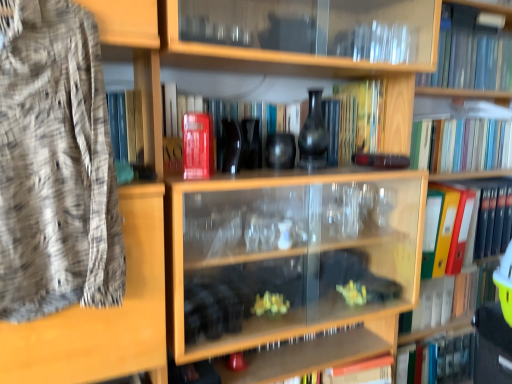
Question: Can you confirm if matte black vase at center is wider than transparent glass book at upper right, the 1th book positioned from the top?

Choices:
 (A) no
 (B) yes

Answer: (A)

Question: Does matte black vase at center lie behind transparent glass book at upper right, the 1th book positioned from the top?

Choices:
 (A) no
 (B) yes

Answer: (A)

Question: Can you confirm if matte black vase at center is thinner than transparent glass book at upper right, marked as the seventh book in a bottom-to-top arrangement?

Choices:
 (A) yes
 (B) no

Answer: (A)

Question: Can you confirm if matte black vase at center is smaller than transparent glass book at upper right, the 1th book positioned from the top?

Choices:
 (A) yes
 (B) no

Answer: (A)

Question: Considering the relative positions of matte black vase at center and transparent glass book at upper right, marked as the seventh book in a bottom-to-top arrangement, in the image provided, is matte black vase at center to the right of transparent glass book at upper right, marked as the seventh book in a bottom-to-top arrangement, from the viewer's perspective?

Choices:
 (A) no
 (B) yes

Answer: (A)

Question: Is point (481, 292) closer or farther from the camera than point (309, 102)?

Choices:
 (A) closer
 (B) farther

Answer: (B)

Question: From the image's perspective, is yellow plastic folder at right, which is the 1th book in bottom-to-top order, located above or below matte black vase at center?

Choices:
 (A) above
 (B) below

Answer: (B)

Question: Is yellow plastic folder at right, which is the seventh book from top to bottom, wider or thinner than matte black vase at center?

Choices:
 (A) wide
 (B) thin

Answer: (A)

Question: Based on their positions, is yellow plastic folder at right, which is the 1th book in bottom-to-top order, located to the left or right of matte black vase at center?

Choices:
 (A) left
 (B) right

Answer: (B)

Question: Considering the positions of multicolored hardcover books at upper right, placed as the 5th book when sorted from bottom to top, and transparent glass book at upper right, marked as the seventh book in a bottom-to-top arrangement, in the image, is multicolored hardcover books at upper right, placed as the 5th book when sorted from bottom to top, taller or shorter than transparent glass book at upper right, marked as the seventh book in a bottom-to-top arrangement,?

Choices:
 (A) short
 (B) tall

Answer: (B)

Question: Does point (461, 145) appear closer or farther from the camera than point (457, 21)?

Choices:
 (A) closer
 (B) farther

Answer: (B)

Question: Relative to transparent glass book at upper right, marked as the seventh book in a bottom-to-top arrangement, is multicolored hardcover books at upper right, the 3th book in the top-to-bottom sequence, in front or behind?

Choices:
 (A) front
 (B) behind

Answer: (B)

Question: Based on their positions, is multicolored hardcover books at upper right, placed as the 5th book when sorted from bottom to top, located to the left or right of transparent glass book at upper right, marked as the seventh book in a bottom-to-top arrangement?

Choices:
 (A) left
 (B) right

Answer: (A)

Question: In terms of size, does yellow plastic folder at right, which is the 1th book in bottom-to-top order, appear bigger or smaller than matte red book at center, which ranks as the 4th book in top-to-bottom order?

Choices:
 (A) big
 (B) small

Answer: (B)

Question: Do you think yellow plastic folder at right, which is the seventh book from top to bottom, is within matte red book at center, arranged as the 4th book when ordered from the bottom, or outside of it?

Choices:
 (A) inside
 (B) outside

Answer: (B)